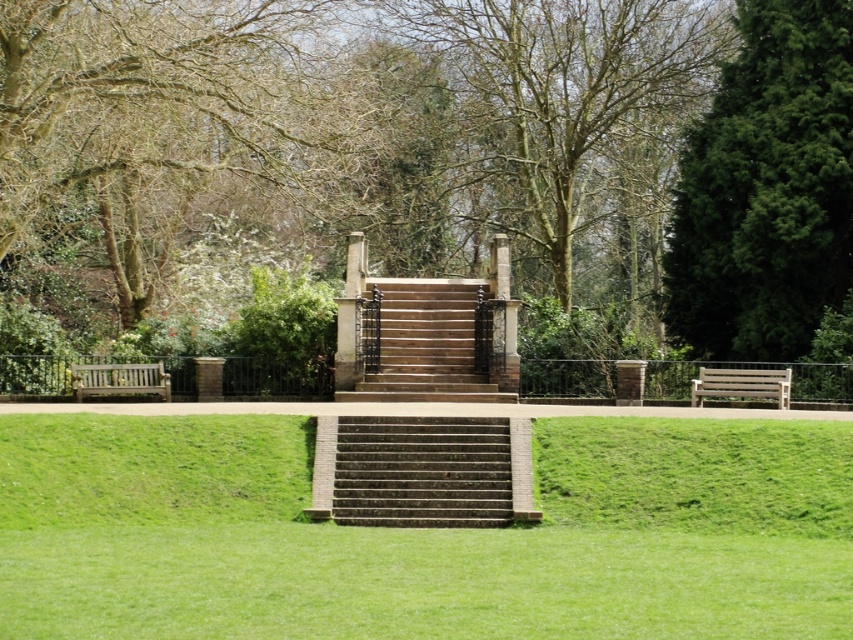
Does brown stone stairs at center have a larger size compared to wooden park bench at left?

Yes.

What do you see at coordinates (426, 344) in the screenshot?
I see `brown stone stairs at center` at bounding box center [426, 344].

Locate an element on the screen. The image size is (853, 640). brown stone stairs at center is located at coordinates click(x=426, y=344).

Can you confirm if green textured tree at right is positioned to the left of brown stone stairs at center?

Incorrect, green textured tree at right is not on the left side of brown stone stairs at center.

Who is lower down, green textured tree at right or brown stone stairs at center?

brown stone stairs at center is below.

Locate an element on the screen. The width and height of the screenshot is (853, 640). green textured tree at right is located at coordinates (766, 189).

You are a GUI agent. You are given a task and a screenshot of the screen. Output one action in this format:
    pyautogui.click(x=<x>, y=<y>)
    Task: Click on the green textured tree at right
    
    Given the screenshot: What is the action you would take?
    coord(766,189)

Does dark brown stone stairs at center have a greater width compared to brown stone stairs at center?

Yes.

Between point (392, 492) and point (376, 385), which one is positioned behind?

The point (376, 385) is behind.

The height and width of the screenshot is (640, 853). In order to click on dark brown stone stairs at center in this screenshot , I will do click(422, 472).